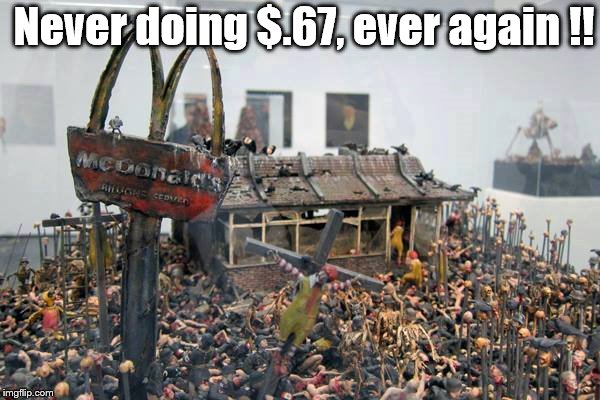
The width and height of the screenshot is (600, 400). I want to click on door, so click(x=401, y=211).